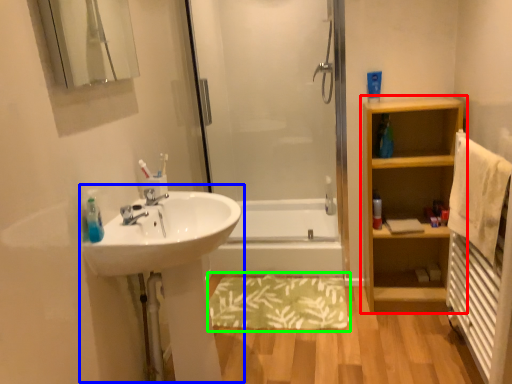
Question: Considering the real-world distances, which object is farthest from bathroom cabinet (highlighted by a red box)? sink (highlighted by a blue box) or bath mat (highlighted by a green box)?

Choices:
 (A) sink
 (B) bath mat

Answer: (A)